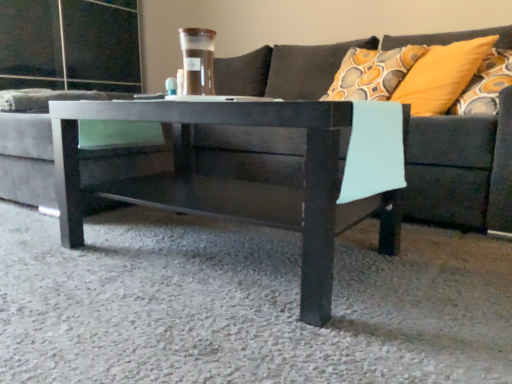
Question: From the image's perspective, relative to dark gray fabric couch at center, is matte black coffee table at center above or below?

Choices:
 (A) above
 (B) below

Answer: (B)

Question: Is matte black coffee table at center to the left or to the right of dark gray fabric couch at center in the image?

Choices:
 (A) left
 (B) right

Answer: (A)

Question: Estimate the real-world distances between objects in this image. Which object is closer to the yellow fabric pillow at upper right?

Choices:
 (A) matte black coffee table at center
 (B) dark gray fabric couch at center

Answer: (B)

Question: Estimate the real-world distances between objects in this image. Which object is farther from the yellow fabric pillow at upper right?

Choices:
 (A) matte black coffee table at center
 (B) dark gray fabric couch at center

Answer: (A)